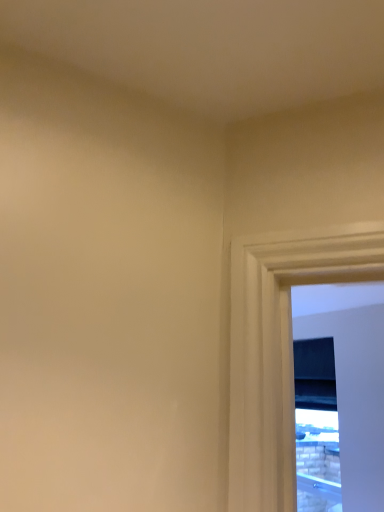
Measure the distance between point (321, 355) and camera.

Result: A distance of 10.94 feet exists between point (321, 355) and camera.

Where is `brick textured bay window at right`? Image resolution: width=384 pixels, height=512 pixels. brick textured bay window at right is located at coordinates (316, 425).

This screenshot has height=512, width=384. Describe the element at coordinates (316, 425) in the screenshot. I see `brick textured bay window at right` at that location.

In order to face brick textured bay window at right, should I rotate leftwards or rightwards?

To face it directly, rotate right by 16.025 degrees.

Locate an element on the screen. The image size is (384, 512). brick textured bay window at right is located at coordinates (316, 425).